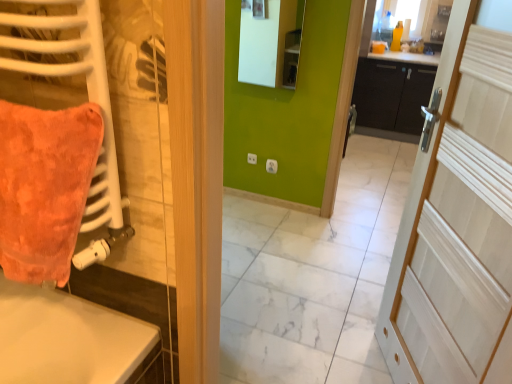
I want to click on white matte radiator at left, so click(x=87, y=91).

Where is `orange plush throw pillow at left`? orange plush throw pillow at left is located at coordinates (44, 187).

Image resolution: width=512 pixels, height=384 pixels. What do you see at coordinates (44, 187) in the screenshot? I see `orange plush throw pillow at left` at bounding box center [44, 187].

You are a GUI agent. You are given a task and a screenshot of the screen. Output one action in this format:
    pyautogui.click(x=<x>, y=<y>)
    Task: Click on the white matte radiator at left
    
    Given the screenshot: What is the action you would take?
    pyautogui.click(x=87, y=91)

From the image's perspective, who appears lower, orange plush throw pillow at left or white matte radiator at left?

From the image's view, orange plush throw pillow at left is below.

Considering the sizes of objects orange plush throw pillow at left and white matte radiator at left in the image provided, who is bigger, orange plush throw pillow at left or white matte radiator at left?

Bigger between the two is white matte radiator at left.

Is white matte radiator at left at the back of orange plush throw pillow at left?

Yes, orange plush throw pillow at left's orientation is away from white matte radiator at left.

Can you tell me how much orange plush throw pillow at left and white matte radiator at left differ in facing direction?

The angle between the facing direction of orange plush throw pillow at left and the facing direction of white matte radiator at left is 4.46e-05 degrees.

Between orange plush throw pillow at left and matte white mirror at upper center, which one has more height?

matte white mirror at upper center.

Is orange plush throw pillow at left aimed at matte white mirror at upper center?

No, orange plush throw pillow at left is not oriented towards matte white mirror at upper center.

Which is more to the right, orange plush throw pillow at left or matte white mirror at upper center?

matte white mirror at upper center.

Is white matte radiator at left completely or partially outside of orange plush throw pillow at left?

Indeed, white matte radiator at left is completely outside orange plush throw pillow at left.

What are the coordinates of `throw pillow below the white matte radiator at left (from a real-world perspective)` in the screenshot? It's located at (44, 187).

What's the angular difference between white matte radiator at left and orange plush throw pillow at left's facing directions?

The facing directions of white matte radiator at left and orange plush throw pillow at left are 4.46e-05 degrees apart.

Does white matte radiator at left have a larger size compared to orange plush throw pillow at left?

Yes.

From a real-world perspective, which object rests below the other?

In real-world perspective, black matte cabinet at center is lower.

Is point (89, 162) positioned in front of point (376, 91)?

Yes, it is in front of point (376, 91).

Is orange plush throw pillow at left not within black matte cabinet at center?

Yes, orange plush throw pillow at left is outside of black matte cabinet at center.

From the image's perspective, between white matte radiator at left and matte white mirror at upper center, who is located below?

white matte radiator at left, from the image's perspective.

Which is more to the left, white matte radiator at left or matte white mirror at upper center?

From the viewer's perspective, white matte radiator at left appears more on the left side.

Can you tell me how much white matte radiator at left and matte white mirror at upper center differ in facing direction?

The angle between the facing direction of white matte radiator at left and the facing direction of matte white mirror at upper center is 0.000732 degrees.

From a real-world perspective, which is physically above, white matte radiator at left or matte white mirror at upper center?

In real-world perspective, white matte radiator at left is above.

Which is closer, (22, 71) or (408, 222)?

Point (22, 71).

From a real-world perspective, who is located higher, white matte radiator at left or white wood door at right?

From a 3D spatial view, white matte radiator at left is above.

Are white matte radiator at left and white wood door at right located far from each other?

Absolutely, white matte radiator at left is distant from white wood door at right.

Considering the sizes of objects white matte radiator at left and white wood door at right in the image provided, who is bigger, white matte radiator at left or white wood door at right?

white wood door at right.

Can you tell me how much matte white mirror at upper center and white matte radiator at left differ in facing direction?

The angle between the facing direction of matte white mirror at upper center and the facing direction of white matte radiator at left is 0.000732 degrees.

Considering the points (283, 24) and (57, 74), which point is behind, point (283, 24) or point (57, 74)?

The point (283, 24) is behind.

From the image's perspective, is matte white mirror at upper center over white matte radiator at left?

Correct, matte white mirror at upper center appears higher than white matte radiator at left in the image.

Based on the photo, between matte white mirror at upper center and white matte radiator at left, which one is positioned behind?

matte white mirror at upper center.

Locate an element on the screen. throw pillow below the white matte radiator at left (from the image's perspective) is located at coordinates (44, 187).

Locate an element on the screen. Image resolution: width=512 pixels, height=384 pixels. throw pillow in front of the matte white mirror at upper center is located at coordinates (44, 187).

Considering their positions, is white matte radiator at left positioned closer to orange plush throw pillow at left than black matte cabinet at center?

white matte radiator at left lies closer to orange plush throw pillow at left than the other object.

Consider the image. Estimate the real-world distances between objects in this image. Which object is further from black matte cabinet at center, white matte radiator at left or matte white mirror at upper center?

The object further to black matte cabinet at center is white matte radiator at left.

Looking at the image, which one is located further to white matte radiator at left, orange plush throw pillow at left or matte white mirror at upper center?

Among the two, matte white mirror at upper center is located further to white matte radiator at left.

Which object lies further to the anchor point white wood door at right, black matte cabinet at center or orange plush throw pillow at left?

black matte cabinet at center lies further to white wood door at right than the other object.

When comparing their distances from orange plush throw pillow at left, does black matte cabinet at center or white matte radiator at left seem closer?

white matte radiator at left is closer to orange plush throw pillow at left.

Based on their spatial positions, is white wood door at right or white matte radiator at left closer to matte white mirror at upper center?

white wood door at right.

Which object lies nearer to the anchor point black matte cabinet at center, white wood door at right or matte white mirror at upper center?

matte white mirror at upper center lies closer to black matte cabinet at center than the other object.

Looking at the image, which one is located closer to white wood door at right, matte white mirror at upper center or orange plush throw pillow at left?

orange plush throw pillow at left.

Find the location of `throw pillow positioned between white matte radiator at left and matte white mirror at upper center from near to far`. throw pillow positioned between white matte radiator at left and matte white mirror at upper center from near to far is located at coordinates (44, 187).

I want to click on throw pillow between white matte radiator at left and white wood door at right from left to right, so click(44, 187).

The image size is (512, 384). Identify the location of throw pillow positioned between white wood door at right and matte white mirror at upper center from near to far. (44, 187).

Where is `mirror between white wood door at right and black matte cabinet at center from front to back`? mirror between white wood door at right and black matte cabinet at center from front to back is located at coordinates (267, 41).